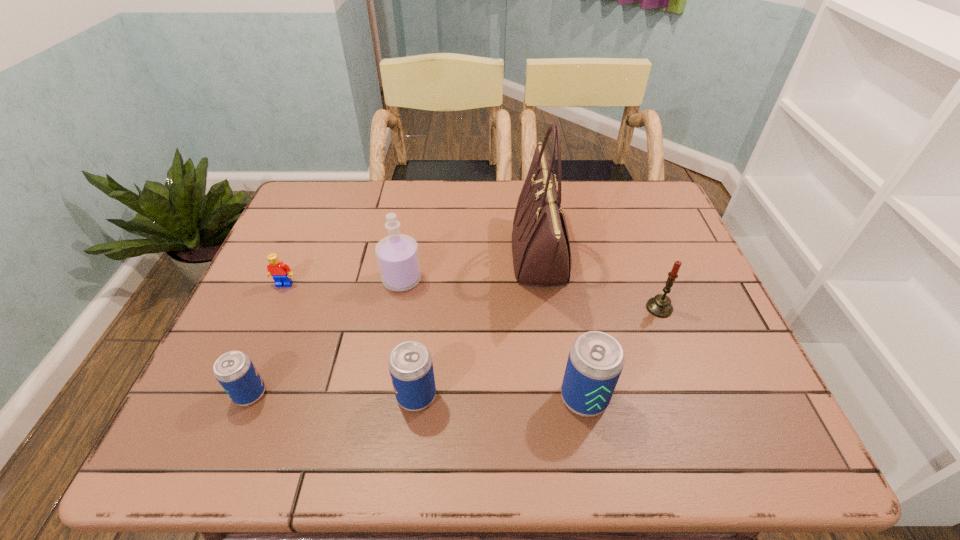
In the current image, all beer cans are evenly spaced. To maintain this equal spacing, where should an additional beer can be placed on the right? Please point out a free spot. Please provide its 2D coordinates. Your answer should be formatted as a tuple, i.e. [(x, y)], where the tuple contains the x and y coordinates of a point satisfying the conditions above.

[(753, 400)]